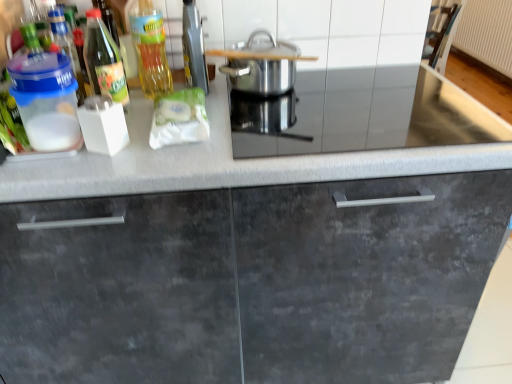
In order to face transparent plastic container at left, the 1th bottle viewed from the left, should I rotate leftwards or rightwards?

You should rotate left by 24.265 degrees.

Measure the distance between matte gray cabinet at center and camera.

matte gray cabinet at center and camera are 31.45 inches apart.

Where is `matte gray cabinet at center`? This screenshot has width=512, height=384. matte gray cabinet at center is located at coordinates (249, 283).

Measure the distance between translucent plastic bottle at upper left, arranged as the 1th bottle when viewed from the right, and camera.

translucent plastic bottle at upper left, arranged as the 1th bottle when viewed from the right, and camera are 38.74 inches apart from each other.

Image resolution: width=512 pixels, height=384 pixels. What do you see at coordinates (104, 61) in the screenshot?
I see `translucent glass bottle at upper left, marked as the 2th bottle in a right-to-left arrangement` at bounding box center [104, 61].

At what (x,y) coordinates should I click in order to perform the action: click on translucent glass bottle at upper left, the second bottle viewed from the left. Please return your answer as a coordinate pair (x, y). Image resolution: width=512 pixels, height=384 pixels. Looking at the image, I should click on [104, 61].

Locate an element on the screen. The image size is (512, 384). translucent plastic container at upper left is located at coordinates (46, 100).

From the image's perspective, is translucent plastic bottle at upper left, the third bottle when ordered from left to right, positioned above or below matte gray cabinet at center?

Based on their image positions, translucent plastic bottle at upper left, the third bottle when ordered from left to right, is located above matte gray cabinet at center.

Considering the sizes of objects translucent plastic bottle at upper left, the third bottle when ordered from left to right, and matte gray cabinet at center in the image provided, who is taller, translucent plastic bottle at upper left, the third bottle when ordered from left to right, or matte gray cabinet at center?

Standing taller between the two is matte gray cabinet at center.

Identify the location of cabinetry below the translucent plastic bottle at upper left, arranged as the 1th bottle when viewed from the right (from the image's perspective). Image resolution: width=512 pixels, height=384 pixels. (249, 283).

At what (x,y) coordinates should I click in order to perform the action: click on the 2nd bottle to the left of the white textured radiator at upper right, starting your count from the anchor. Please return your answer as a coordinate pair (x, y). The image size is (512, 384). Looking at the image, I should click on (104, 61).

Is white textured radiator at upper right a part of translucent glass bottle at upper left, marked as the 2th bottle in a right-to-left arrangement?

No, white textured radiator at upper right is not inside translucent glass bottle at upper left, marked as the 2th bottle in a right-to-left arrangement.

In the scene shown: Is translucent glass bottle at upper left, marked as the 2th bottle in a right-to-left arrangement, far away from white textured radiator at upper right?

Yes.

Could you measure the distance between white textured radiator at upper right and translucent glass bottle at upper left, the second bottle viewed from the left?

white textured radiator at upper right is 11.76 feet away from translucent glass bottle at upper left, the second bottle viewed from the left.

From a real-world perspective, is white textured radiator at upper right positioned above or below translucent glass bottle at upper left, the second bottle viewed from the left?

white textured radiator at upper right is below translucent glass bottle at upper left, the second bottle viewed from the left.

Which of these two, white textured radiator at upper right or translucent glass bottle at upper left, marked as the 2th bottle in a right-to-left arrangement, is thinner?

Thinner between the two is translucent glass bottle at upper left, marked as the 2th bottle in a right-to-left arrangement.

Locate an element on the screen. the 1st bottle located above the white textured radiator at upper right (from a real-world perspective) is located at coordinates (104, 61).

Does translucent glass bottle at upper left, the second bottle viewed from the left, have a greater height compared to white matte packet at center?

Correct, translucent glass bottle at upper left, the second bottle viewed from the left, is much taller as white matte packet at center.

Does translucent glass bottle at upper left, the second bottle viewed from the left, turn towards white matte packet at center?

No, translucent glass bottle at upper left, the second bottle viewed from the left, does not turn towards white matte packet at center.

How distant is translucent glass bottle at upper left, the second bottle viewed from the left, from white matte packet at center?

translucent glass bottle at upper left, the second bottle viewed from the left, and white matte packet at center are 6.61 inches apart from each other.

Based on their sizes in the image, would you say translucent glass bottle at upper left, marked as the 2th bottle in a right-to-left arrangement, is bigger or smaller than white matte packet at center?

Considering their sizes, translucent glass bottle at upper left, marked as the 2th bottle in a right-to-left arrangement, takes up less space than white matte packet at center.

Is matte gray cabinet at center smaller than metallic silver toaster at upper center?

Incorrect, matte gray cabinet at center is not smaller in size than metallic silver toaster at upper center.

From a real-world perspective, which object stands above the other?

metallic silver toaster at upper center is physically above.

How many degrees apart are the facing directions of matte gray cabinet at center and metallic silver toaster at upper center?

91.7 degrees separate the facing orientations of matte gray cabinet at center and metallic silver toaster at upper center.

Is matte gray cabinet at center far from metallic silver toaster at upper center?

matte gray cabinet at center is actually quite close to metallic silver toaster at upper center.

Is translucent plastic container at upper left turned away from translucent glass bottle at upper left, marked as the 2th bottle in a right-to-left arrangement?

No, translucent plastic container at upper left is not facing the opposite direction of translucent glass bottle at upper left, marked as the 2th bottle in a right-to-left arrangement.

Which is more distant, (39, 98) or (112, 80)?

The point (112, 80) is behind.

Considering the positions of objects metallic silver toaster at upper center and matte gray cabinet at center in the image provided, who is more to the right, metallic silver toaster at upper center or matte gray cabinet at center?

matte gray cabinet at center.

Based on the photo, which object is thinner, metallic silver toaster at upper center or matte gray cabinet at center?

With smaller width is metallic silver toaster at upper center.

Does metallic silver toaster at upper center have a lesser height compared to matte gray cabinet at center?

Correct, metallic silver toaster at upper center is not as tall as matte gray cabinet at center.

From the image's perspective, who appears lower, metallic silver toaster at upper center or matte gray cabinet at center?

matte gray cabinet at center.

Where is `cabinetry below the translucent plastic bottle at upper left, arranged as the 1th bottle when viewed from the right (from a real-world perspective)`? This screenshot has width=512, height=384. cabinetry below the translucent plastic bottle at upper left, arranged as the 1th bottle when viewed from the right (from a real-world perspective) is located at coordinates (249, 283).

At what (x,y) coordinates should I click in order to perform the action: click on radiator to the right of translucent glass bottle at upper left, marked as the 2th bottle in a right-to-left arrangement. Please return your answer as a coordinate pair (x, y). The height and width of the screenshot is (384, 512). Looking at the image, I should click on (487, 33).

Looking at the image, which one is located further to stainless steel pot at center, translucent plastic container at upper left or white matte packet at center?

translucent plastic container at upper left is further to stainless steel pot at center.

Based on their spatial positions, is metallic silver toaster at upper center or stainless steel pot at center further from transparent plastic container at left, the 1th bottle viewed from the left?

stainless steel pot at center is further to transparent plastic container at left, the 1th bottle viewed from the left.

Looking at the image, which one is located further to translucent plastic bottle at upper left, arranged as the 1th bottle when viewed from the right, stainless steel pot at center or white textured radiator at upper right?

Among the two, white textured radiator at upper right is located further to translucent plastic bottle at upper left, arranged as the 1th bottle when viewed from the right.

Which object lies further to the anchor point translucent glass bottle at upper left, marked as the 2th bottle in a right-to-left arrangement, stainless steel pot at center or translucent plastic container at upper left?

stainless steel pot at center is positioned further to the anchor translucent glass bottle at upper left, marked as the 2th bottle in a right-to-left arrangement.

Which object lies nearer to the anchor point metallic silver toaster at upper center, matte gray cabinet at center or transparent plastic container at left, which ranks as the third bottle in right-to-left order?

transparent plastic container at left, which ranks as the third bottle in right-to-left order, lies closer to metallic silver toaster at upper center than the other object.

Considering their positions, is metallic silver toaster at upper center positioned further to matte gray cabinet at center than transparent plastic container at left, which ranks as the third bottle in right-to-left order?

transparent plastic container at left, which ranks as the third bottle in right-to-left order.

Based on their spatial positions, is white matte packet at center or stainless steel pot at center closer to translucent plastic container at upper left?

white matte packet at center lies closer to translucent plastic container at upper left than the other object.

Which object lies nearer to the anchor point matte gray cabinet at center, translucent plastic container at upper left or stainless steel pot at center?

translucent plastic container at upper left is closer to matte gray cabinet at center.

Where is `food between translucent plastic bottle at upper left, arranged as the 1th bottle when viewed from the right, and white textured radiator at upper right from left to right`? food between translucent plastic bottle at upper left, arranged as the 1th bottle when viewed from the right, and white textured radiator at upper right from left to right is located at coordinates (179, 118).

You are a GUI agent. You are given a task and a screenshot of the screen. Output one action in this format:
    pyautogui.click(x=<x>, y=<y>)
    Task: Click on the food between matte gray cabinet at center and white textured radiator at upper right from front to back
    The width and height of the screenshot is (512, 384).
    Given the screenshot: What is the action you would take?
    pyautogui.click(x=179, y=118)

In order to click on bottle situated between translucent glass bottle at upper left, the second bottle viewed from the left, and white textured radiator at upper right from left to right in this screenshot , I will do `click(149, 47)`.

Locate an element on the screen. This screenshot has height=384, width=512. kitchen appliance between stainless steel pot at center and matte gray cabinet at center in the vertical direction is located at coordinates (46, 100).